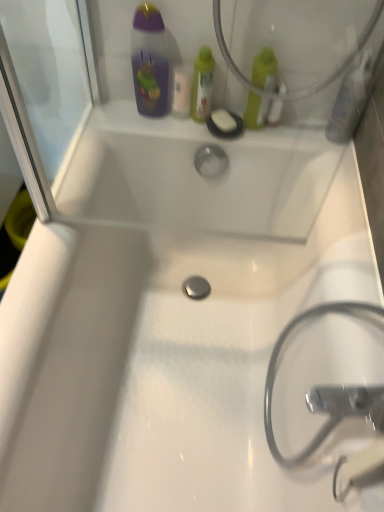
You are a GUI agent. You are given a task and a screenshot of the screen. Output one action in this format:
    pyautogui.click(x=<x>, y=<y>)
    Task: Click on the free space to the left of translucent plastic mouthwash at upper right, arranged as the first mouthwash when viewed from the right
    The image size is (384, 512).
    Given the screenshot: What is the action you would take?
    pyautogui.click(x=301, y=131)